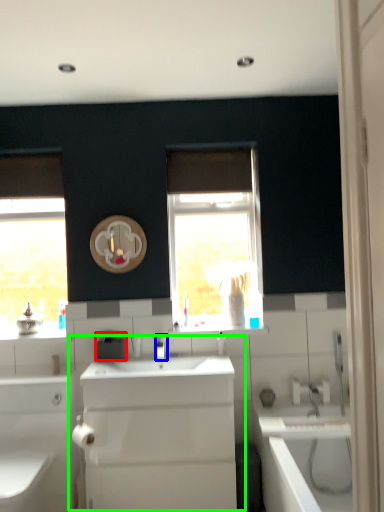
Question: Estimate the real-world distances between objects in this image. Which object is farther from appliance (highlighted by a red box), tap (highlighted by a blue box) or sink (highlighted by a green box)?

Choices:
 (A) tap
 (B) sink

Answer: (B)